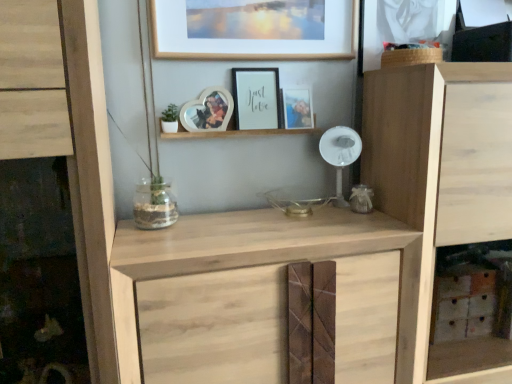
Question: Considering the positions of natural wood cupboard at right, the second cupboard positioned from the left, and natural wood cupboard at left, the 2th cupboard positioned from the right, in the image, is natural wood cupboard at right, the second cupboard positioned from the left, bigger or smaller than natural wood cupboard at left, the 2th cupboard positioned from the right,?

Choices:
 (A) small
 (B) big

Answer: (B)

Question: Looking at their shapes, would you say natural wood cupboard at right, the first cupboard viewed from the right, is wider or thinner than natural wood cupboard at left, the 2th cupboard positioned from the right?

Choices:
 (A) thin
 (B) wide

Answer: (A)

Question: Which is nearer to the natural wood cabinet at center?

Choices:
 (A) wooden picture frame at upper center, the second picture frame in the right-to-left sequence
 (B) natural wood cupboard at left, the 2th cupboard positioned from the right
 (C) matte wooden picture frame at center, placed as the fourth picture frame when sorted from left to right
 (D) clear glass jar at center
 (E) matte black frame at center, which is the 2th picture frame from left to right

Answer: (B)

Question: Estimate the real-world distances between objects in this image. Which object is closer to the matte wooden picture frame at center, acting as the first picture frame starting from the right?

Choices:
 (A) heart-shaped photo frame at center, arranged as the first picture frame when viewed from the left
 (B) clear glass jar at center
 (C) natural wood cupboard at right, the second cupboard positioned from the left
 (D) wooden picture frame at upper center, the second picture frame in the right-to-left sequence
 (E) white plastic fan at center

Answer: (E)